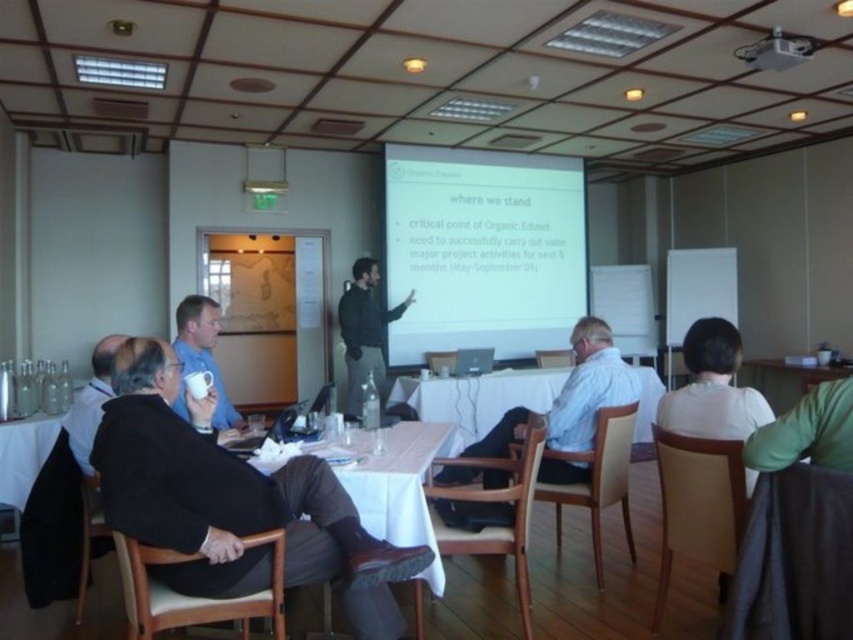
In the scene shown: You are standing at the point marked as point (421, 573) in the conference room. If you walk straight towards the projection screen, will you reach it before the other attendees seated at the tables?

The distance between you and the projection screen is not provided in the scene description, so it is impossible to determine if you will reach it before the other attendees.